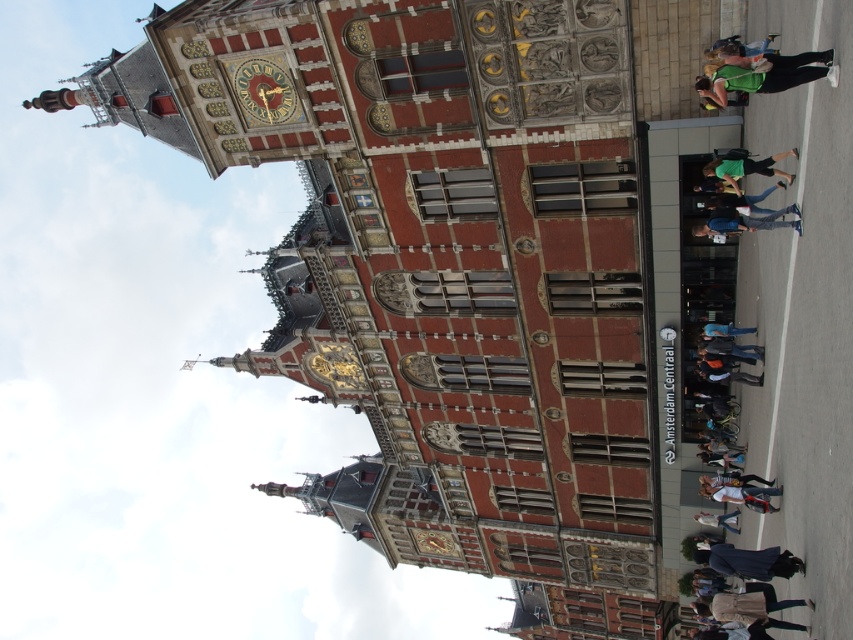
Who is shorter, green fabric bag at upper right or dark blue fabric coat at lower right?

Standing shorter between the two is green fabric bag at upper right.

Between green fabric bag at upper right and dark blue fabric coat at lower right, which one is positioned higher?

green fabric bag at upper right is higher up.

Who is more distant from viewer, (720, 84) or (730, 572)?

Point (730, 572)

Identify the location of green fabric bag at upper right. (762, 74).

Who is lower down, gold metallic clock at upper center or dark blue fabric coat at lower right?

Positioned lower is dark blue fabric coat at lower right.

In the scene shown: Is gold metallic clock at upper center to the left of dark blue fabric coat at lower right from the viewer's perspective?

Indeed, gold metallic clock at upper center is positioned on the left side of dark blue fabric coat at lower right.

Does point (260, 100) come behind point (770, 570)?

Yes.

Image resolution: width=853 pixels, height=640 pixels. Find the location of `gold metallic clock at upper center`. gold metallic clock at upper center is located at coordinates (264, 90).

Describe the element at coordinates (746, 221) in the screenshot. I see `blue denim jeans at center` at that location.

The width and height of the screenshot is (853, 640). Find the location of `blue denim jeans at center`. blue denim jeans at center is located at coordinates (746, 221).

What are the coordinates of `blue denim jeans at center` in the screenshot? It's located at (746, 221).